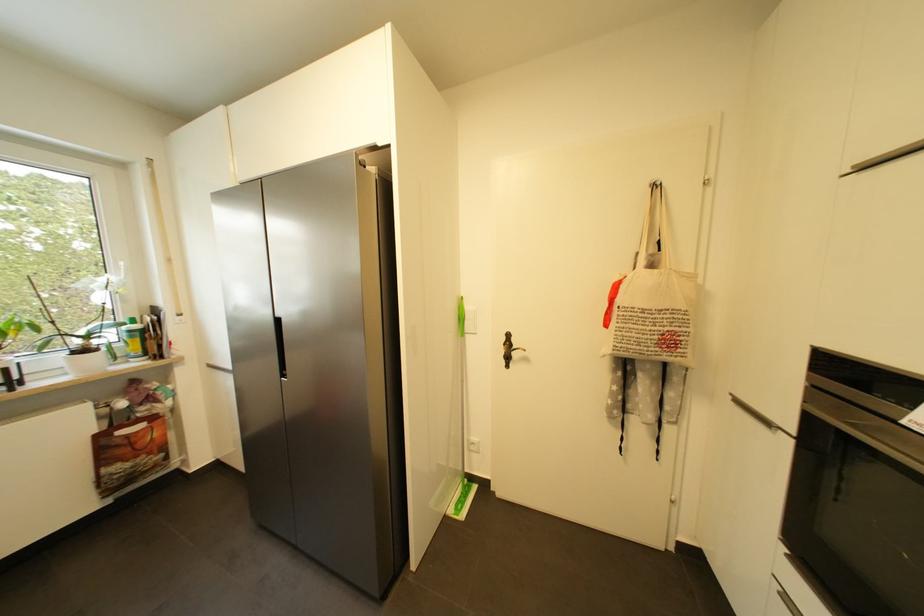
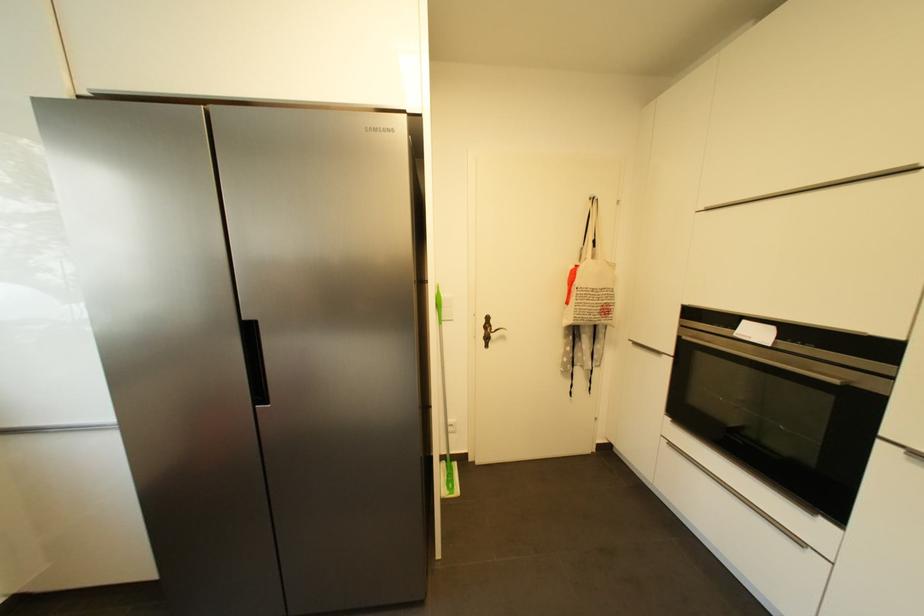
Question: The images are taken continuously from a first-person perspective. In which direction are you moving?

Choices:
 (A) Left
 (B) Right
 (C) Forward
 (D) Backward

Answer: (A)